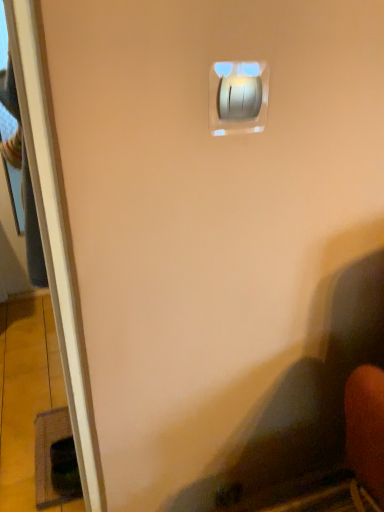
Where is `satin silver switch at upper center`? satin silver switch at upper center is located at coordinates (238, 97).

The height and width of the screenshot is (512, 384). Describe the element at coordinates (238, 97) in the screenshot. I see `satin silver switch at upper center` at that location.

Where is `satin silver switch at upper center`? The height and width of the screenshot is (512, 384). satin silver switch at upper center is located at coordinates (238, 97).